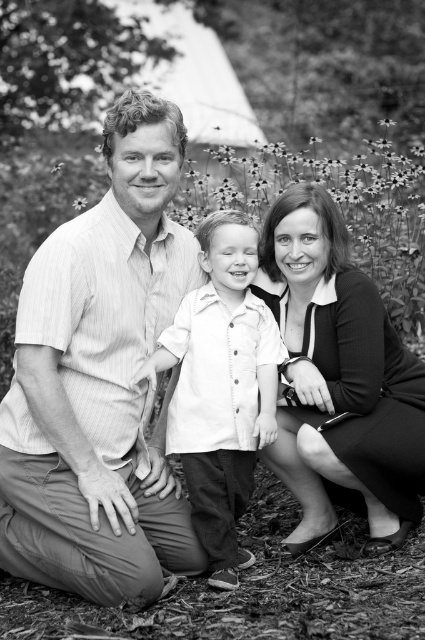
Question: Which object appears farthest from the camera in this image?

Choices:
 (A) black smooth dress at center
 (B) striped cotton shirt at left
 (C) white button-down shirt at center

Answer: (A)

Question: Considering the relative positions of striped cotton shirt at left and white button-down shirt at center in the image provided, where is striped cotton shirt at left located with respect to white button-down shirt at center?

Choices:
 (A) right
 (B) left

Answer: (B)

Question: Which of these objects is positioned farthest from the striped cotton shirt at left?

Choices:
 (A) black smooth dress at center
 (B) white button-down shirt at center

Answer: (A)

Question: Which of the following is the closest to the observer?

Choices:
 (A) white button-down shirt at center
 (B) striped cotton shirt at left
 (C) black smooth dress at center

Answer: (B)

Question: In this image, where is striped cotton shirt at left located relative to black smooth dress at center?

Choices:
 (A) left
 (B) right

Answer: (A)

Question: Considering the relative positions of striped cotton shirt at left and white button-down shirt at center in the image provided, where is striped cotton shirt at left located with respect to white button-down shirt at center?

Choices:
 (A) right
 (B) left

Answer: (B)